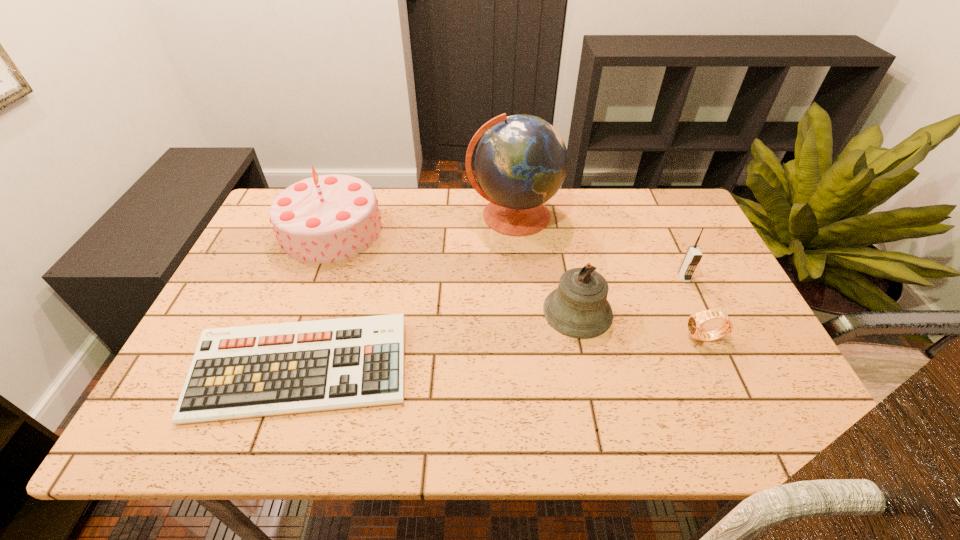
Where is `the tallest object`? This screenshot has width=960, height=540. the tallest object is located at coordinates (521, 161).

This screenshot has width=960, height=540. In order to click on the fifth shortest object in this screenshot , I will do `click(328, 218)`.

The width and height of the screenshot is (960, 540). I want to click on the third farthest object, so click(x=693, y=256).

Find the location of a particular element. bell is located at coordinates pyautogui.click(x=578, y=308).

Where is `watch`? watch is located at coordinates (695, 323).

The height and width of the screenshot is (540, 960). I want to click on computer keyboard, so click(248, 371).

Locate an element on the screen. vacant space situated with the Americas facing the viewer on the globe is located at coordinates (517, 266).

This screenshot has width=960, height=540. What are the coordinates of `vacant space positioned on the front of the fifth shortest object` in the screenshot? It's located at (284, 354).

Image resolution: width=960 pixels, height=540 pixels. I want to click on vacant area situated 0.290m on the front-facing side of the third farthest object, so click(730, 377).

Where is `free space located on the back of the bell`? This screenshot has width=960, height=540. free space located on the back of the bell is located at coordinates (559, 219).